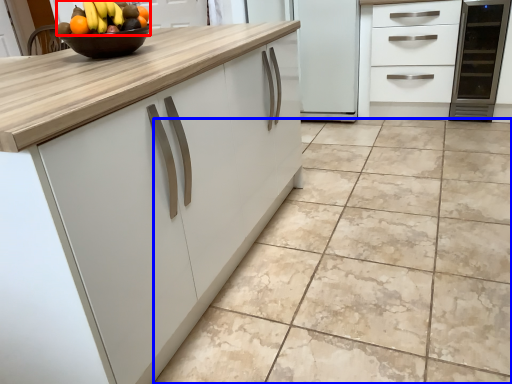
Question: Which point is further to the camera, grapefruit (highlighted by a red box) or ceramic tile (highlighted by a blue box)?

Choices:
 (A) grapefruit
 (B) ceramic tile

Answer: (A)